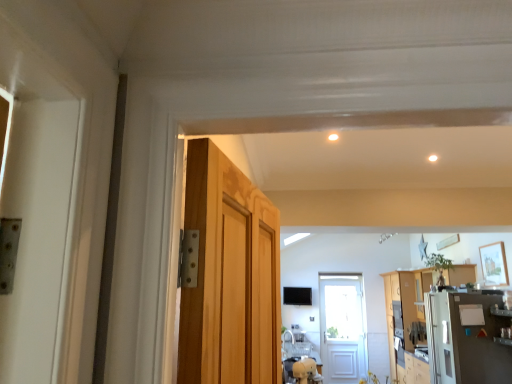
At what (x,y) coordinates should I click in order to perform the action: click on free location to the left of white glossy light at upper center. Please return your answer as a coordinate pair (x, y). The height and width of the screenshot is (384, 512). Looking at the image, I should click on (315, 137).